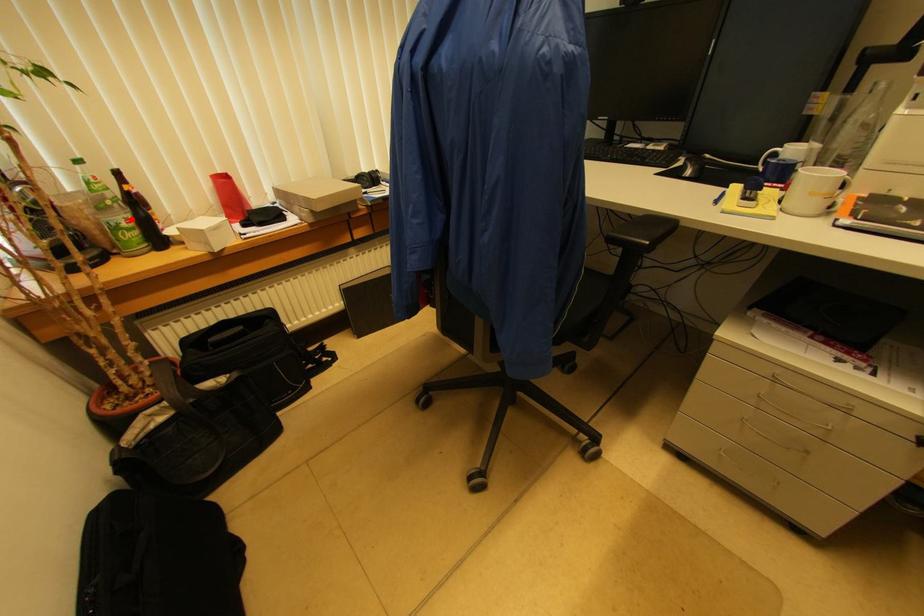
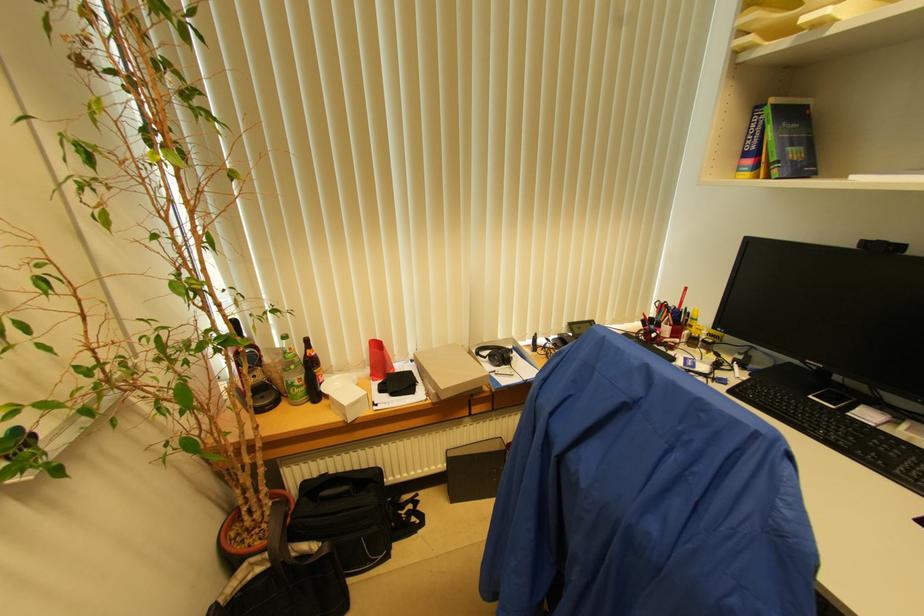
Question: I am providing you with two images of the same scene from different viewpoints. Given a red point in image1, look at the same physical point in image2. Is it:

Choices:
 (A) Closer to the viewpoint
 (B) Farther from the viewpoint

Answer: (A)